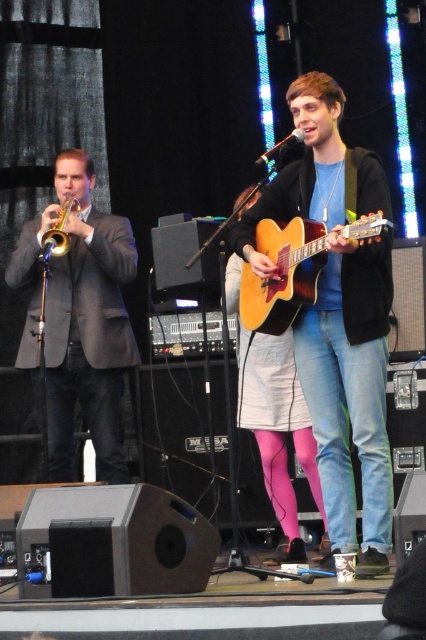
You are a photographer in the audience taking pictures of the stage. You want to capture both the acoustic wood guitar at center and the brass shiny trumpet at left in your photo. Which instrument will appear larger in your photo?

The acoustic wood guitar at center will appear larger in the photo because it is closer to the viewer than the brass shiny trumpet at left.

You are a stagehand who needs to move the acoustic wood guitar at center and the matte black guitar at center to the left side of the stage. However, you can only move one guitar at a time. Which guitar should you move first to ensure you can reach the other one easily?

The acoustic wood guitar at center is behind the matte black guitar at center. Therefore, you should move the matte black guitar at center first to access the acoustic wood guitar at center behind it.